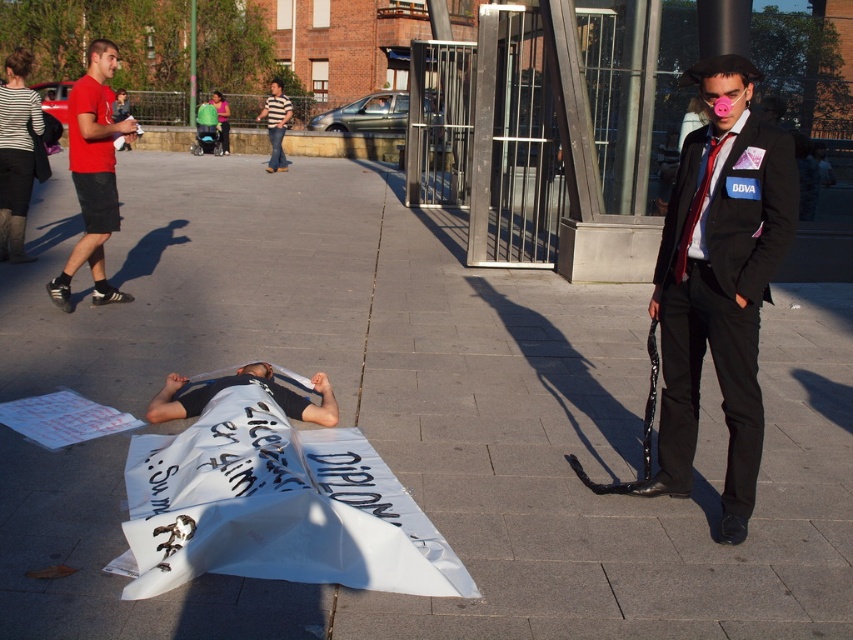
Question: Which object is closer to the camera taking this photo?

Choices:
 (A) black suit at right
 (B) white fabric at center
 (C) red silk tie at right
 (D) red cotton t-shirt at left

Answer: (A)

Question: Which object is closer to the camera taking this photo?

Choices:
 (A) red cotton t-shirt at left
 (B) striped fabric shirt at upper center

Answer: (A)

Question: Can you confirm if white fabric at center is positioned above red silk tie at right?

Choices:
 (A) yes
 (B) no

Answer: (B)

Question: Where is red cotton t-shirt at left located in relation to white fabric at center in the image?

Choices:
 (A) left
 (B) right

Answer: (A)

Question: Which point is farther to the camera?

Choices:
 (A) black suit at right
 (B) red cotton t-shirt at left
 (C) white fabric at center
 (D) striped fabric shirt at upper center

Answer: (D)

Question: Is black suit at right to the left of red cotton t-shirt at left from the viewer's perspective?

Choices:
 (A) no
 (B) yes

Answer: (A)